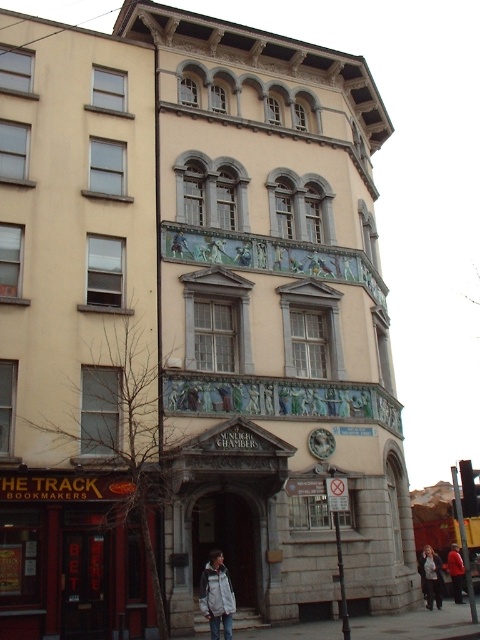
You are trying to decide which jacket to take from the store. Both the white fleece jacket at center and the white cotton jacket at lower center are available. Which one is smaller in size?

The white fleece jacket at center is smaller than the white cotton jacket at lower center, so the white fleece jacket at center is the smaller one.

You are a customer entering the shop with a dark wooden door. You see a white fleece jacket at center and a red jacket at center. Which jacket is visible on top?

The white fleece jacket at center is positioned over the red jacket at center, so the white fleece jacket at center is visible on top.